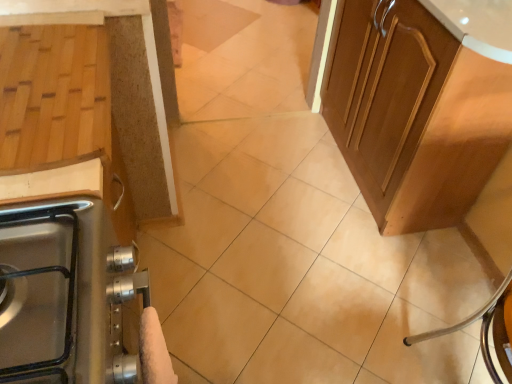
Question: Is wooden cutting board at left, the 1th cabinetry when ordered from left to right, aimed at white fluffy hand towel at lower left?

Choices:
 (A) no
 (B) yes

Answer: (A)

Question: Does wooden cutting board at left, the 1th cabinetry when ordered from left to right, have a greater height compared to white fluffy hand towel at lower left?

Choices:
 (A) no
 (B) yes

Answer: (B)

Question: Is wooden cutting board at left, positioned as the 2th cabinetry in right-to-left order, at the right side of white fluffy hand towel at lower left?

Choices:
 (A) no
 (B) yes

Answer: (A)

Question: From the image's perspective, is wooden cutting board at left, positioned as the 2th cabinetry in right-to-left order, above white fluffy hand towel at lower left?

Choices:
 (A) no
 (B) yes

Answer: (B)

Question: Is wooden cutting board at left, the 1th cabinetry when ordered from left to right, surrounding white fluffy hand towel at lower left?

Choices:
 (A) yes
 (B) no

Answer: (B)

Question: Can you confirm if wooden cutting board at left, the 1th cabinetry when ordered from left to right, is shorter than white fluffy hand towel at lower left?

Choices:
 (A) no
 (B) yes

Answer: (A)

Question: From the image's perspective, is wooden cutting board at left, the 1th cabinetry when ordered from left to right, located beneath glossy wood cabinet at upper right, which is the 2th cabinetry in left-to-right order?

Choices:
 (A) yes
 (B) no

Answer: (A)

Question: Considering the relative sizes of wooden cutting board at left, positioned as the 2th cabinetry in right-to-left order, and glossy wood cabinet at upper right, which is counted as the first cabinetry, starting from the right, in the image provided, is wooden cutting board at left, positioned as the 2th cabinetry in right-to-left order, smaller than glossy wood cabinet at upper right, which is counted as the first cabinetry, starting from the right,?

Choices:
 (A) no
 (B) yes

Answer: (B)

Question: From the image's perspective, is wooden cutting board at left, the 1th cabinetry when ordered from left to right, on top of glossy wood cabinet at upper right, which is the 2th cabinetry in left-to-right order?

Choices:
 (A) no
 (B) yes

Answer: (A)

Question: Is wooden cutting board at left, the 1th cabinetry when ordered from left to right, shorter than glossy wood cabinet at upper right, which is the 2th cabinetry in left-to-right order?

Choices:
 (A) yes
 (B) no

Answer: (B)

Question: From a real-world perspective, does wooden cutting board at left, positioned as the 2th cabinetry in right-to-left order, sit lower than glossy wood cabinet at upper right, which is counted as the first cabinetry, starting from the right?

Choices:
 (A) yes
 (B) no

Answer: (A)

Question: Does wooden cutting board at left, positioned as the 2th cabinetry in right-to-left order, have a larger size compared to glossy wood cabinet at upper right, which is the 2th cabinetry in left-to-right order?

Choices:
 (A) yes
 (B) no

Answer: (B)

Question: Can you confirm if white fluffy hand towel at lower left is bigger than glossy wood cabinet at upper right, which is counted as the first cabinetry, starting from the right?

Choices:
 (A) no
 (B) yes

Answer: (A)